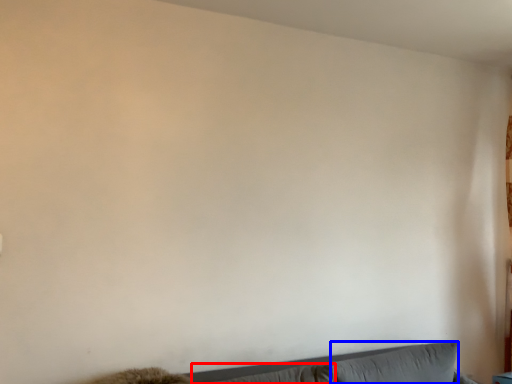
Question: Which object appears farthest to the camera in this image, pillow (highlighted by a red box) or pillow (highlighted by a blue box)?

Choices:
 (A) pillow
 (B) pillow

Answer: (B)